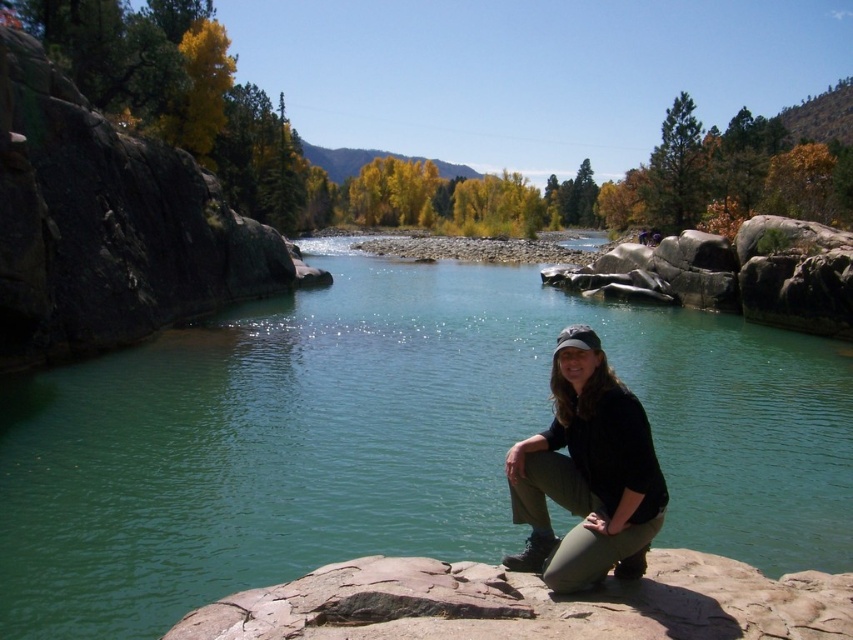
Describe the element at coordinates (387, 442) in the screenshot. I see `clear water at center` at that location.

Which of these two, clear water at center or black matte pants at lower center, stands shorter?

Standing shorter between the two is black matte pants at lower center.

Is point (474, 300) less distant than point (564, 572)?

No, (474, 300) is further to viewer.

I want to click on clear water at center, so click(387, 442).